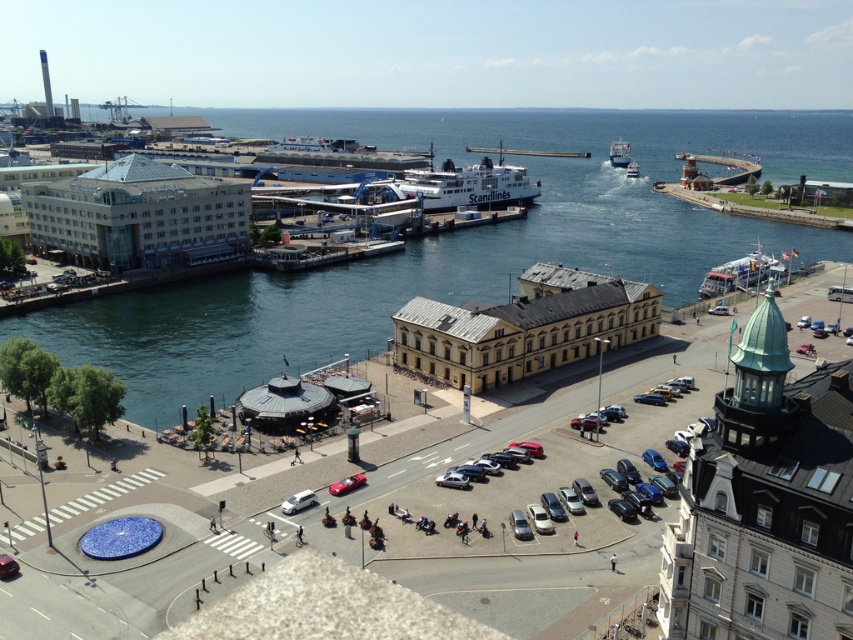
Which of these two, white glossy boat at upper center or shiny red car at center, stands shorter?

shiny red car at center is shorter.

Which is more to the right, white glossy boat at upper center or shiny red car at center?

white glossy boat at upper center is more to the right.

Find the location of a particular element. The image size is (853, 640). white glossy boat at upper center is located at coordinates click(619, 154).

Can you confirm if blue water at center is taller than white plastic boat at center?

Indeed, blue water at center has a greater height compared to white plastic boat at center.

What are the coordinates of `blue water at center` in the screenshot? It's located at (450, 244).

Which of these two, white glossy ferry at right or white plastic boat at center, stands taller?

Standing taller between the two is white plastic boat at center.

Is white glossy ferry at right bigger than white plastic boat at center?

Yes, white glossy ferry at right is bigger than white plastic boat at center.

Where is `white glossy ferry at right`? The width and height of the screenshot is (853, 640). white glossy ferry at right is located at coordinates (740, 273).